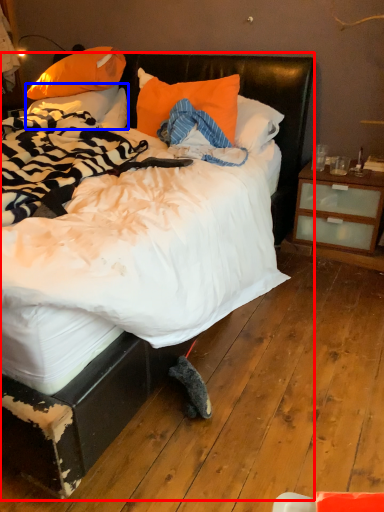
Question: Which object is closer to the camera taking this photo, bed (highlighted by a red box) or pillow (highlighted by a blue box)?

Choices:
 (A) bed
 (B) pillow

Answer: (A)